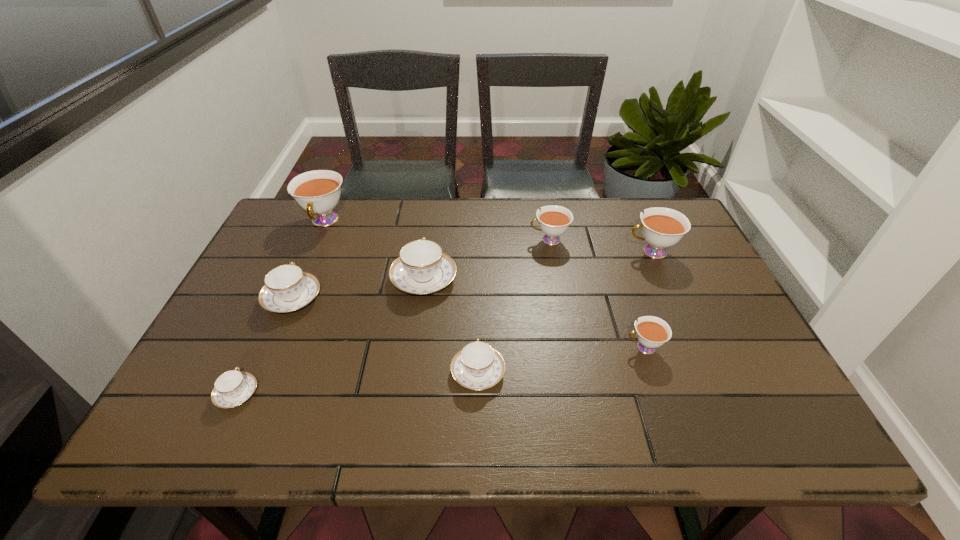
Locate an element on the screen. the smallest blue teacup is located at coordinates (232, 388).

Locate an element on the screen. This screenshot has width=960, height=540. the shortest teacup is located at coordinates (232, 388).

Where is `vacant area situated 0.170m on the side of the biggest white teacup with the handle`? Image resolution: width=960 pixels, height=540 pixels. vacant area situated 0.170m on the side of the biggest white teacup with the handle is located at coordinates (300, 278).

I want to click on blank space located 0.400m on the side of the second tallest teacup with the handle, so click(489, 252).

The width and height of the screenshot is (960, 540). I want to click on vacant area situated 0.110m on the side of the second tallest teacup with the handle, so click(x=588, y=252).

Where is `free spot located 0.390m on the side of the second tallest teacup with the handle`? free spot located 0.390m on the side of the second tallest teacup with the handle is located at coordinates (492, 252).

This screenshot has height=540, width=960. In order to click on vacant position located on the side with the handle of the biggest blue teacup in this screenshot , I will do `click(430, 232)`.

Identify the location of blank space located 0.060m on the side with the handle of the biggest blue teacup. (428, 245).

I want to click on vacant area situated 0.080m on the side with the handle of the biggest blue teacup, so click(x=429, y=240).

This screenshot has height=540, width=960. In order to click on free point located on the side of the second smallest white teacup with the handle in this screenshot , I will do `click(506, 240)`.